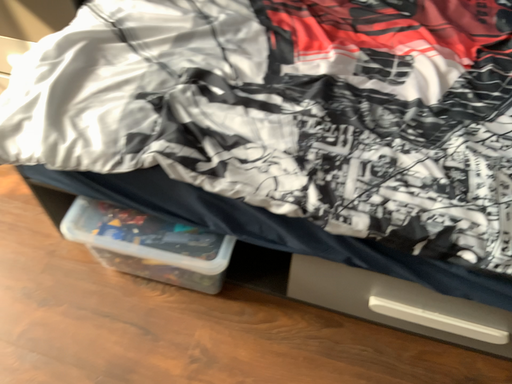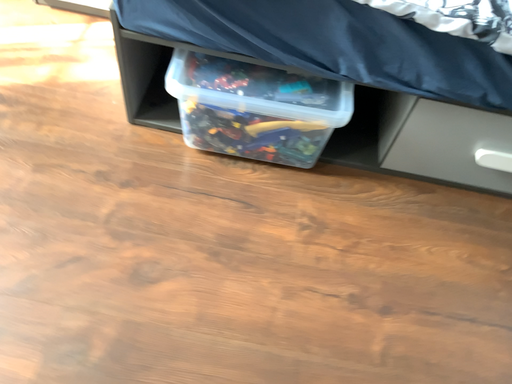
Question: Which way did the camera rotate in the video?

Choices:
 (A) rotated left
 (B) rotated right

Answer: (B)